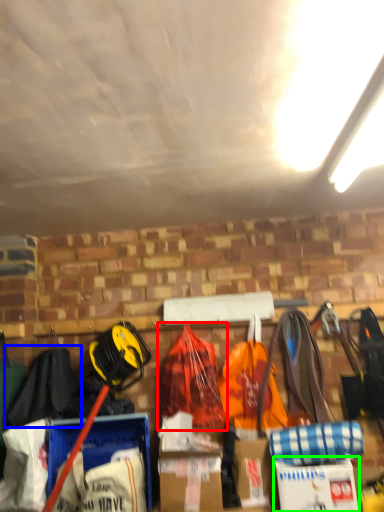
Question: Considering the real-world distances, which object is closest to backpack (highlighted by a red box)? clothing (highlighted by a blue box) or cardboard box (highlighted by a green box).

Choices:
 (A) clothing
 (B) cardboard box

Answer: (B)